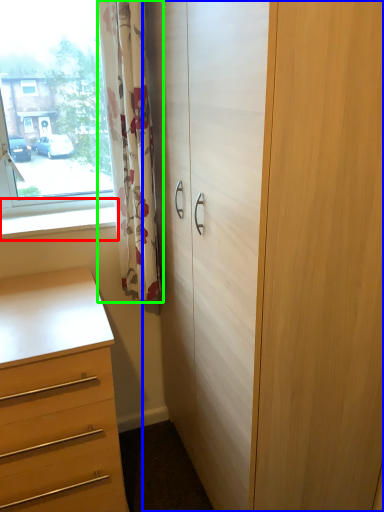
Question: Considering the real-world distances, which object is closest to window sill (highlighted by a red box)? cupboard (highlighted by a blue box) or curtain (highlighted by a green box).

Choices:
 (A) cupboard
 (B) curtain

Answer: (B)